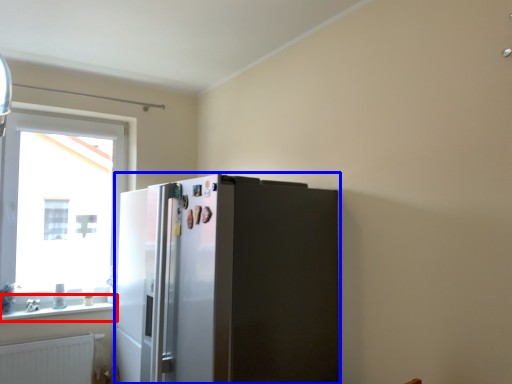
Question: Among these objects, which one is farthest to the camera, window sill (highlighted by a red box) or refrigerator (highlighted by a blue box)?

Choices:
 (A) window sill
 (B) refrigerator

Answer: (A)